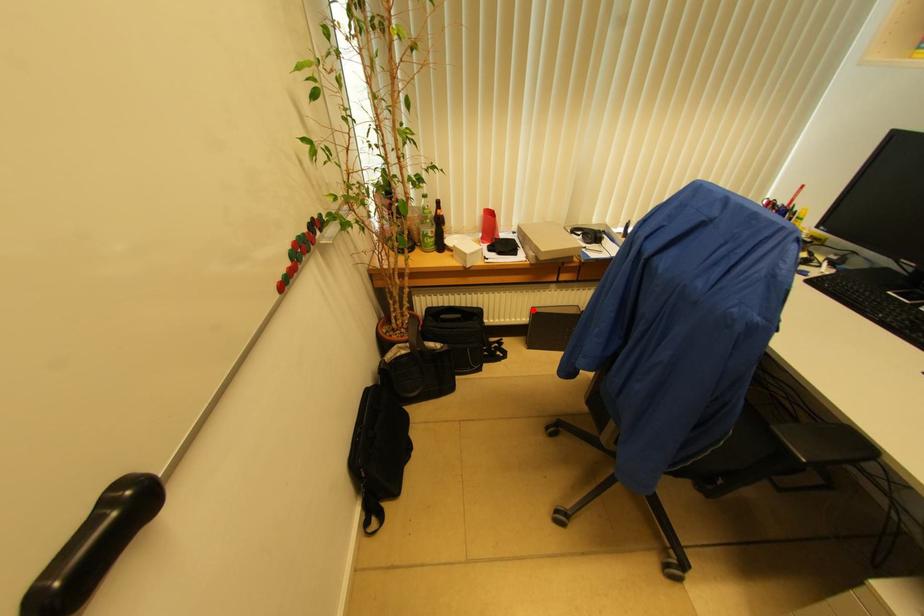
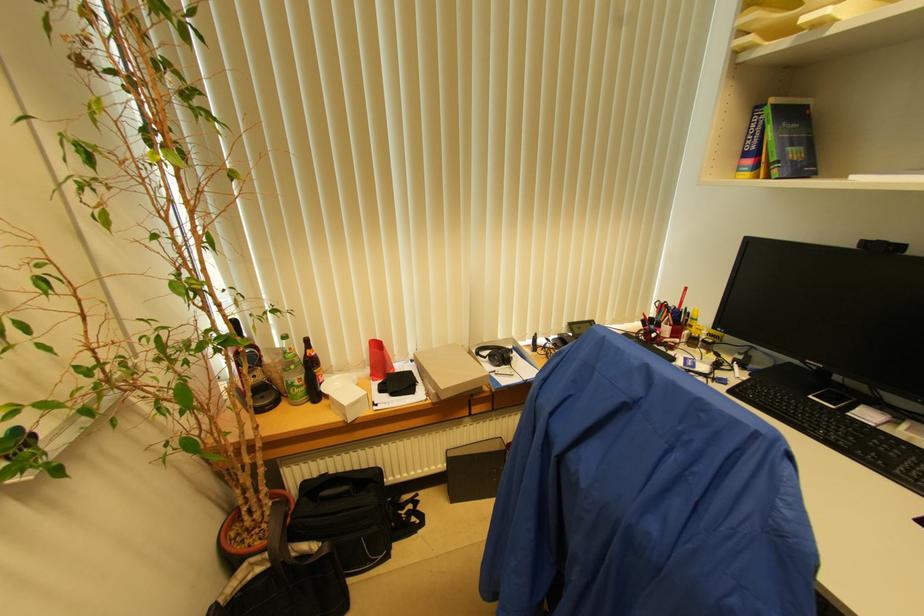
Question: I am providing you with two images of the same scene from different viewpoints. A red point is shown in image1. For the corresponding object point in image2, is it positioned nearer or farther from the camera?

Choices:
 (A) Nearer
 (B) Farther

Answer: (B)